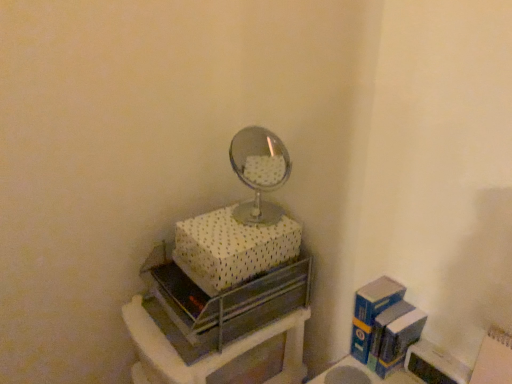
Identify the location of white dotted fabric box at upper center, which appears as the second box when ordered from the bottom. (232, 248).

The width and height of the screenshot is (512, 384). What do you see at coordinates (371, 312) in the screenshot? I see `blue cardboard box at right, the first box when ordered from right to left` at bounding box center [371, 312].

Where is `metallic silver drawer at center`? The height and width of the screenshot is (384, 512). metallic silver drawer at center is located at coordinates 210,354.

Is point (385, 288) closer to camera compared to point (229, 248)?

No, it is behind (229, 248).

Considering the relative positions of blue cardboard box at right, the first box when ordered from right to left, and white dotted fabric box at upper center, the 1th box from the top, in the image provided, is blue cardboard box at right, the first box when ordered from right to left, in front of white dotted fabric box at upper center, the 1th box from the top,?

That is False.

From a real-world perspective, is blue cardboard box at right, the first box when ordered from right to left, positioned above or below white dotted fabric box at upper center, the 1th box from the top?

blue cardboard box at right, the first box when ordered from right to left, is situated lower than white dotted fabric box at upper center, the 1th box from the top, in the real world.

Locate an element on the screen. The width and height of the screenshot is (512, 384). box that appears in front of the blue cardboard box at right, acting as the first box starting from the bottom is located at coordinates (232, 248).

Would you consider white dotted fabric box at upper center, which appears as the second box when ordered from the bottom, to be distant from blue cardboard box at right, acting as the first box starting from the bottom?

No, white dotted fabric box at upper center, which appears as the second box when ordered from the bottom, is not far away from blue cardboard box at right, acting as the first box starting from the bottom.

Is white dotted fabric box at upper center, which is the 1th box from left to right, completely or partially outside of blue cardboard box at right, acting as the first box starting from the bottom?

Indeed, white dotted fabric box at upper center, which is the 1th box from left to right, is completely outside blue cardboard box at right, acting as the first box starting from the bottom.

From the image's perspective, between white dotted fabric box at upper center, the 1th box from the top, and blue cardboard box at right, the first box when ordered from right to left, which one is located above?

white dotted fabric box at upper center, the 1th box from the top, from the image's perspective.

From a real-world perspective, is white dotted fabric box at upper center, which appears as the second box when ordered from the bottom, beneath blue cardboard box at right, acting as the first box starting from the bottom?

No, from a real-world perspective, white dotted fabric box at upper center, which appears as the second box when ordered from the bottom, is not below blue cardboard box at right, acting as the first box starting from the bottom.

Find the location of a particular element. the 2nd box behind the metallic silver drawer at center, counting from the anchor's position is located at coordinates (371, 312).

How many degrees apart are the facing directions of blue cardboard box at right, the first box when ordered from right to left, and metallic silver drawer at center?

0.00364 degrees separate the facing orientations of blue cardboard box at right, the first box when ordered from right to left, and metallic silver drawer at center.

From a real-world perspective, who is located higher, blue cardboard box at right, the second box from the top, or metallic silver drawer at center?

blue cardboard box at right, the second box from the top, from a real-world perspective.

Is blue cardboard box at right, the 2th box from the left, in front of metallic silver drawer at center?

No, blue cardboard box at right, the 2th box from the left, is further to the viewer.

Is metallic silver drawer at center facing away from blue cardboard box at right, the 2th box from the left?

metallic silver drawer at center is not turned away from blue cardboard box at right, the 2th box from the left.

How different are the orientations of metallic silver drawer at center and blue cardboard box at right, the second box from the top, in degrees?

The angle between the facing direction of metallic silver drawer at center and the facing direction of blue cardboard box at right, the second box from the top, is 0.00364 degrees.

Is metallic silver drawer at center directly adjacent to blue cardboard box at right, acting as the first box starting from the bottom?

No, metallic silver drawer at center is not with blue cardboard box at right, acting as the first box starting from the bottom.

Is metallic silver drawer at center to the left of blue cardboard box at right, acting as the first box starting from the bottom, from the viewer's perspective?

Yes.

From a real-world perspective, which object stands above the other?

In real-world perspective, white dotted fabric box at upper center, the 1th box from the top, is above.

From the picture: Can you tell me how much metallic silver drawer at center and white dotted fabric box at upper center, the 1th box from the top, differ in facing direction?

0.00719 degrees.

From the picture: Which is further, (134, 329) or (294, 250)?

Positioned behind is point (294, 250).

In the scene shown: Is metallic silver drawer at center oriented away from white dotted fabric box at upper center, the second box in the right-to-left sequence?

That's not correct — metallic silver drawer at center is not looking away from white dotted fabric box at upper center, the second box in the right-to-left sequence.

Considering the relative sizes of white dotted fabric box at upper center, which appears as the second box when ordered from the bottom, and metallic silver drawer at center in the image provided, is white dotted fabric box at upper center, which appears as the second box when ordered from the bottom, taller than metallic silver drawer at center?

No, white dotted fabric box at upper center, which appears as the second box when ordered from the bottom, is not taller than metallic silver drawer at center.

Can you confirm if white dotted fabric box at upper center, which is the 1th box from left to right, is smaller than metallic silver drawer at center?

Yes, white dotted fabric box at upper center, which is the 1th box from left to right, is smaller than metallic silver drawer at center.

Considering their positions, is white dotted fabric box at upper center, which appears as the second box when ordered from the bottom, located in front of or behind metallic silver drawer at center?

white dotted fabric box at upper center, which appears as the second box when ordered from the bottom, is behind metallic silver drawer at center.

Can you confirm if white dotted fabric box at upper center, the second box in the right-to-left sequence, is positioned to the right of metallic silver drawer at center?

Indeed, white dotted fabric box at upper center, the second box in the right-to-left sequence, is positioned on the right side of metallic silver drawer at center.

In order to click on box located on the right of white dotted fabric box at upper center, which appears as the second box when ordered from the bottom in this screenshot , I will do `click(371, 312)`.

Find the location of a particular element. Image resolution: width=512 pixels, height=384 pixels. box that appears below the white dotted fabric box at upper center, the second box in the right-to-left sequence (from a real-world perspective) is located at coordinates (371, 312).

Looking at the image, which one is located further to white dotted fabric box at upper center, which is the 1th box from left to right, metallic silver drawer at center or blue cardboard box at right, the second box from the top?

blue cardboard box at right, the second box from the top, is positioned further to the anchor white dotted fabric box at upper center, which is the 1th box from left to right.

When comparing their distances from blue cardboard box at right, the 2th box from the left, does white dotted fabric box at upper center, the 1th box from the top, or metallic silver drawer at center seem further?

white dotted fabric box at upper center, the 1th box from the top, lies further to blue cardboard box at right, the 2th box from the left, than the other object.

Which object lies further to the anchor point blue cardboard box at right, acting as the first box starting from the bottom, metallic silver drawer at center or white dotted fabric box at upper center, which is the 1th box from left to right?

white dotted fabric box at upper center, which is the 1th box from left to right.

Based on their spatial positions, is blue cardboard box at right, the first box when ordered from right to left, or white dotted fabric box at upper center, which appears as the second box when ordered from the bottom, further from metallic silver drawer at center?

blue cardboard box at right, the first box when ordered from right to left, is further to metallic silver drawer at center.

Looking at the image, which one is located further to metallic silver drawer at center, white dotted fabric box at upper center, the second box in the right-to-left sequence, or blue cardboard box at right, the second box from the top?

The object further to metallic silver drawer at center is blue cardboard box at right, the second box from the top.

When comparing their distances from white dotted fabric box at upper center, which appears as the second box when ordered from the bottom, does blue cardboard box at right, the first box when ordered from right to left, or metallic silver drawer at center seem closer?

metallic silver drawer at center lies closer to white dotted fabric box at upper center, which appears as the second box when ordered from the bottom, than the other object.

Locate an element on the screen. box between metallic silver drawer at center and blue cardboard box at right, the second box from the top is located at coordinates (232, 248).